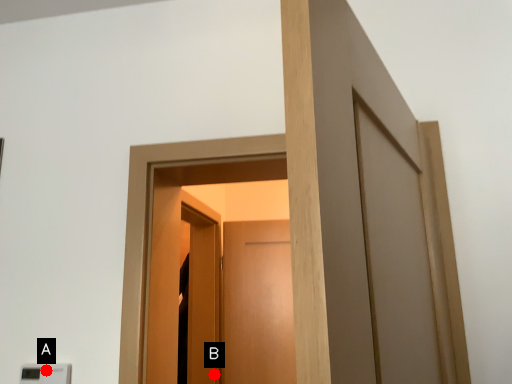
Question: Two points are circled on the image, labeled by A and B beside each circle. Which point is further to the camera?

Choices:
 (A) A is further
 (B) B is further

Answer: (B)